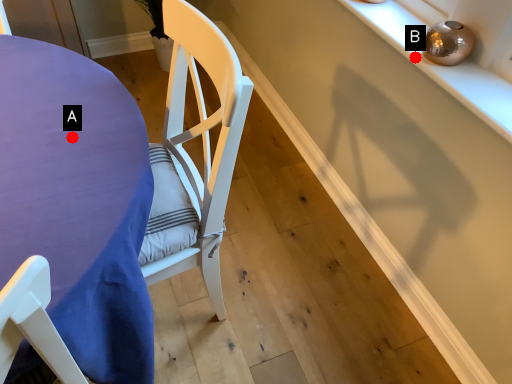
Question: Two points are circled on the image, labeled by A and B beside each circle. Which point appears farthest from the camera in this image?

Choices:
 (A) A is further
 (B) B is further

Answer: (B)